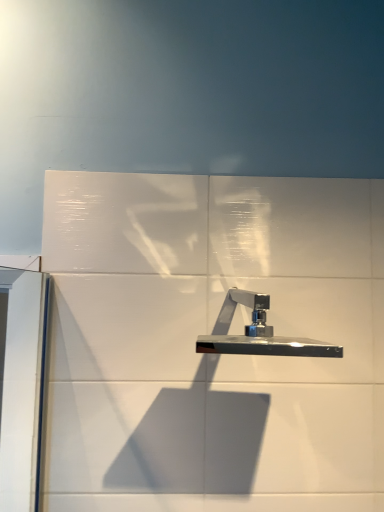
You are a GUI agent. You are given a task and a screenshot of the screen. Output one action in this format:
    pyautogui.click(x=<x>, y=<y>)
    Task: Click on the polished chrome tap at center
    
    Given the screenshot: What is the action you would take?
    pyautogui.click(x=258, y=333)

Describe the element at coordinates (258, 333) in the screenshot. I see `polished chrome tap at center` at that location.

Find the location of `polished chrome tap at center`. polished chrome tap at center is located at coordinates (258, 333).